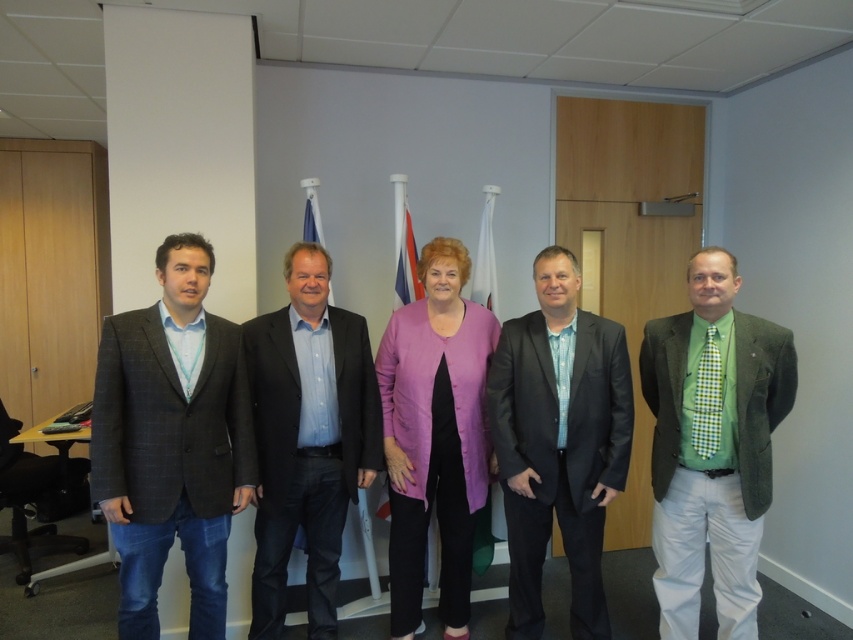
You are a photographer setting up a shot in the conference room. You need to ensure that the dark gray checkered suit at left and the green plaid tie at right are both in focus. Which object should you adjust your camera focus to first, the one closer to you or the one further away?

The dark gray checkered suit at left is shorter than the green plaid tie at right, meaning it is closer to you. Adjust focus to the dark gray checkered suit at left first since it is nearer.

You are a photographer in a conference room. You need to capture a photo of the blue shirt at center and the purple fabric jacket at center. Which one is closer to the camera?

The blue shirt at center is in front of the purple fabric jacket at center, so it is closer to the camera.

You are a photographer setting up for a group photo. You need to position yourself between the dark gray checkered suit at left and the green plaid tie at right to capture both in the frame. Given that your camera has a maximum focus range of 1.5 meters, will you be able to include both subjects in the same shot?

The dark gray checkered suit at left and green plaid tie at right are 1.60 meters apart from each other. Since the distance exceeds the camera maximum focus range of 1.5 meters, you cannot include both subjects in the same shot.